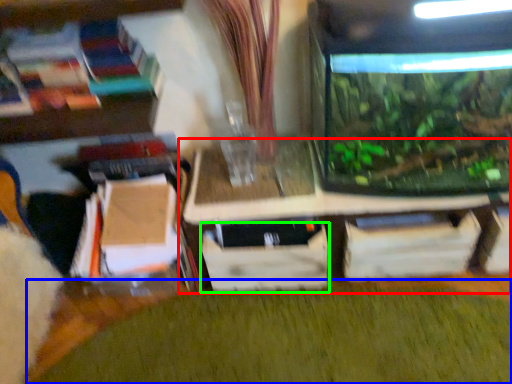
Question: Based on their relative distances, which object is nearer to table (highlighted by a red box)? Choose from plant (highlighted by a blue box) and drawer (highlighted by a green box).

Choices:
 (A) plant
 (B) drawer

Answer: (B)